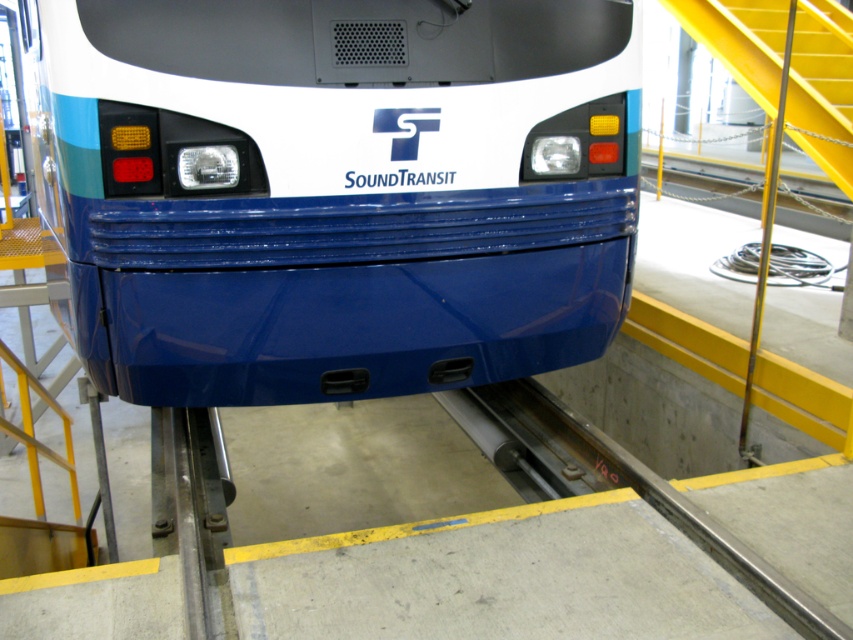
Can you confirm if glossy blue train at center is shorter than yellow metal stairs at upper right?

No.

Does glossy blue train at center have a greater height compared to yellow metal stairs at upper right?

Correct, glossy blue train at center is much taller as yellow metal stairs at upper right.

What do you see at coordinates (334, 189) in the screenshot?
I see `glossy blue train at center` at bounding box center [334, 189].

I want to click on glossy blue train at center, so click(x=334, y=189).